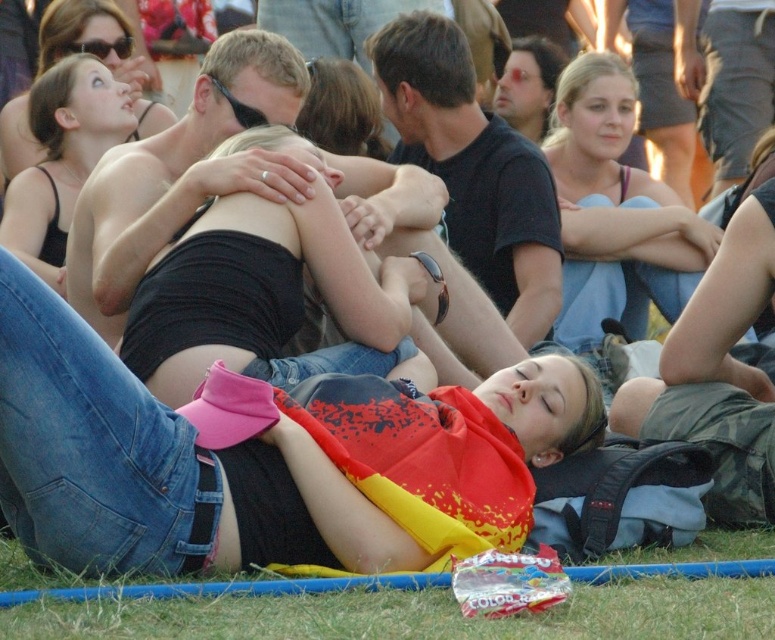
You are a photographer trying to capture a photo of the green grass at lower center and the matte black tank top at upper left. Which object is shorter in height?

The green grass at lower center is shorter than the matte black tank top at upper left.